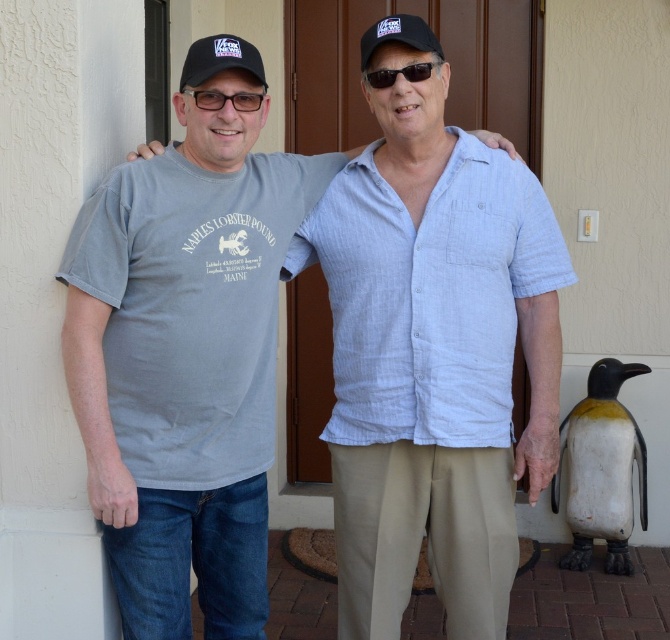
Question: Which of the following is the farthest from the observer?

Choices:
 (A) (234, 65)
 (B) (383, 22)
 (C) (200, 90)
 (D) (582, 554)

Answer: (D)

Question: Does black fabric baseball cap at upper left appear under matte plastic glasses at upper center?

Choices:
 (A) yes
 (B) no

Answer: (B)

Question: Which object is farther from the camera taking this photo?

Choices:
 (A) sunglasses at center
 (B) matte plastic glasses at upper center

Answer: (A)

Question: Which object is farther from the camera taking this photo?

Choices:
 (A) white matte penguin at lower right
 (B) matte plastic glasses at upper center

Answer: (A)

Question: Can you confirm if gray cotton t-shirt at left is positioned to the left of black fabric baseball cap at upper left?

Choices:
 (A) yes
 (B) no

Answer: (A)

Question: Is black fabric baseball cap at upper left smaller than matte plastic glasses at upper center?

Choices:
 (A) no
 (B) yes

Answer: (A)